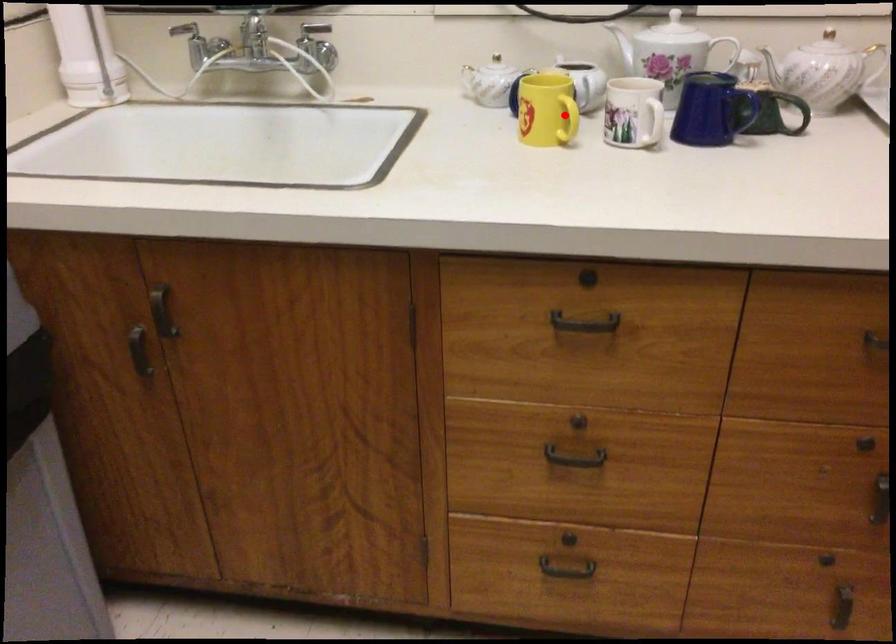
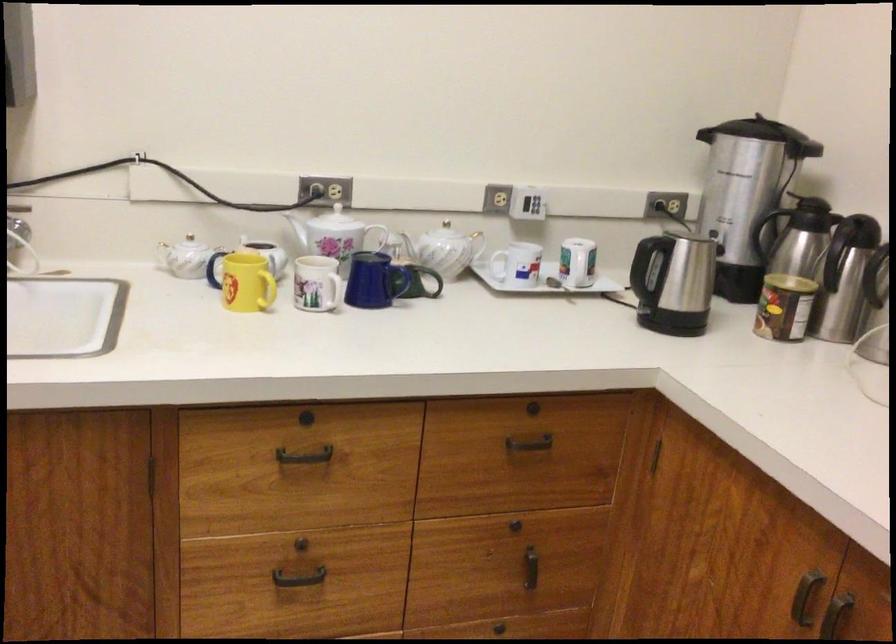
Question: I am providing you with two images of the same scene from different viewpoints. Image1 has a red point marked. In image2, the corresponding 3D location appears at what relative position? Reply with the corresponding letter.

Choices:
 (A) Closer
 (B) Farther

Answer: (B)